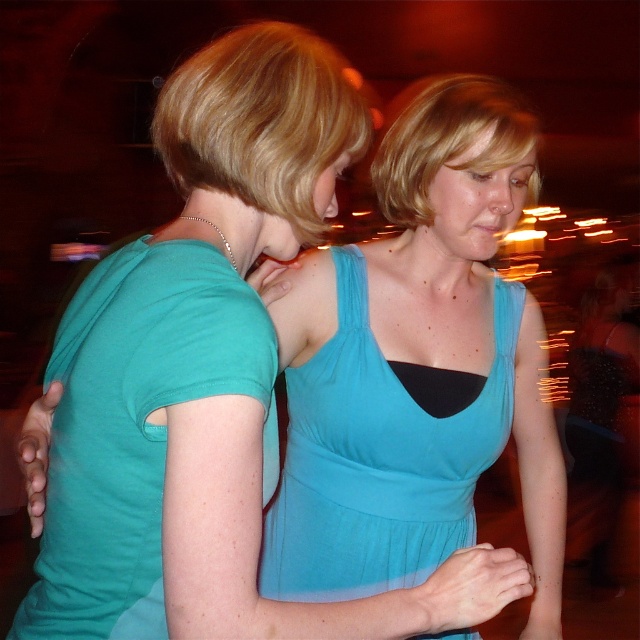
Question: Which object is closer to the camera taking this photo?

Choices:
 (A) blonde hair at upper center
 (B) matte teal shirt at left
 (C) teal jersey dress at center

Answer: (B)

Question: Which of the following is the farthest from the observer?

Choices:
 (A) matte teal shirt at left
 (B) teal jersey dress at center

Answer: (B)

Question: Is matte teal shirt at left wider than blonde hair at upper center?

Choices:
 (A) no
 (B) yes

Answer: (A)

Question: Does matte teal shirt at left come behind teal jersey dress at center?

Choices:
 (A) no
 (B) yes

Answer: (A)

Question: Among these objects, which one is nearest to the camera?

Choices:
 (A) matte teal shirt at left
 (B) blonde hair at upper center

Answer: (A)

Question: Does matte teal shirt at left have a greater width compared to blonde hair at upper center?

Choices:
 (A) yes
 (B) no

Answer: (B)